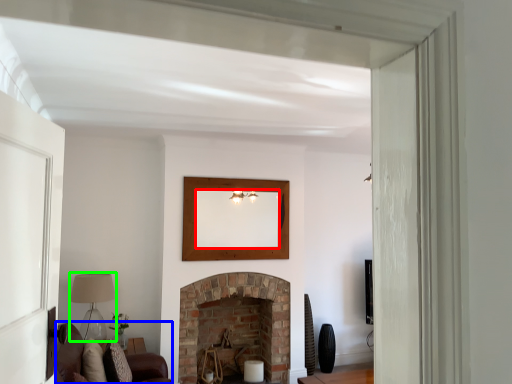
Question: Which object is positioned farthest from mirror (highlighted by a red box)? Select from couch (highlighted by a blue box) and lamp (highlighted by a green box).

Choices:
 (A) couch
 (B) lamp

Answer: (A)